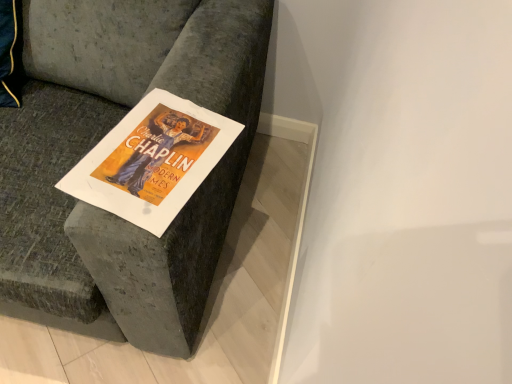
Question: Is point (108, 137) positioned closer to the camera than point (129, 319)?

Choices:
 (A) farther
 (B) closer

Answer: (B)

Question: Considering the positions of orange paper poster at center and velvet gray couch at upper left in the image, is orange paper poster at center taller or shorter than velvet gray couch at upper left?

Choices:
 (A) tall
 (B) short

Answer: (B)

Question: Looking at their shapes, would you say orange paper poster at center is wider or thinner than velvet gray couch at upper left?

Choices:
 (A) wide
 (B) thin

Answer: (B)

Question: Is point (154, 9) closer or farther from the camera than point (58, 183)?

Choices:
 (A) farther
 (B) closer

Answer: (A)

Question: Is velvet gray couch at upper left inside or outside of orange paper poster at center?

Choices:
 (A) outside
 (B) inside

Answer: (A)

Question: In the image, is velvet gray couch at upper left positioned in front of or behind orange paper poster at center?

Choices:
 (A) behind
 (B) front

Answer: (B)

Question: From a real-world perspective, relative to orange paper poster at center, is velvet gray couch at upper left vertically above or below?

Choices:
 (A) above
 (B) below

Answer: (B)